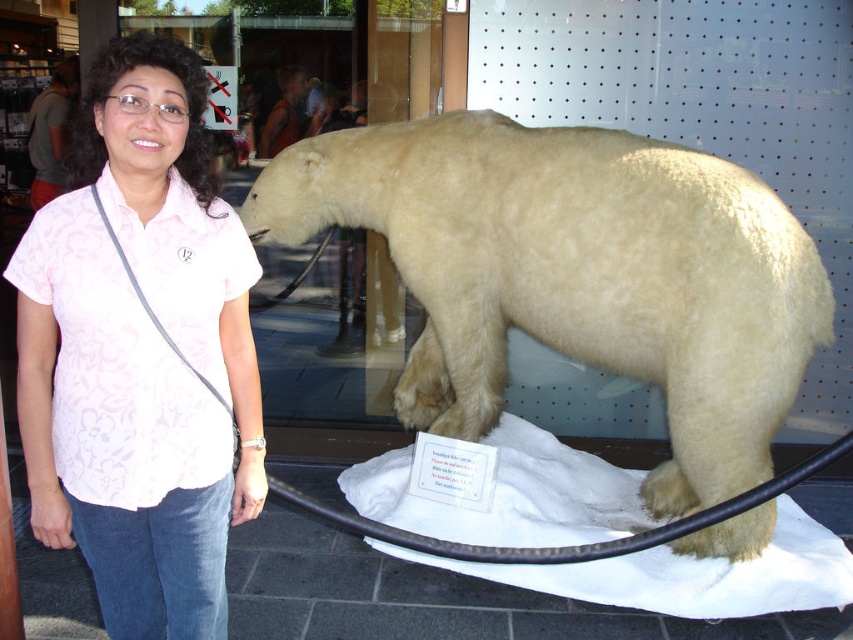
You are a photographer who wants to take a picture of the white fur polar bear at center. The camera you are using has a focal length of 50mm and an aperture of f2.8. To ensure the polar bear is in focus, where should you focus your camera? Please provide the coordinates in the format of a point like this example format, e.g., point A is at point B.

The white fur polar bear at center is located at point (579, 294), so you should focus your camera at point (579, 294) to ensure the polar bear is in focus.

You are a photographer trying to capture a clear photo of the white fur polar bear at center without the pink floral shirt at center appearing in the foreground. Is this possible given their positions?

The white fur polar bear at center is positioned over the pink floral shirt at center, meaning the polar bear is in front of the shirt. Therefore, it is possible to take a clear photo of the polar bear without the shirt appearing in the foreground by focusing on the bear and ensuring the shirt is out of the frame.

What is the color of the polar bear at the point specified by the coordinates (579, 294)?

The point at coordinates (579, 294) indicates the white fur polar bear at center, so the color is white.